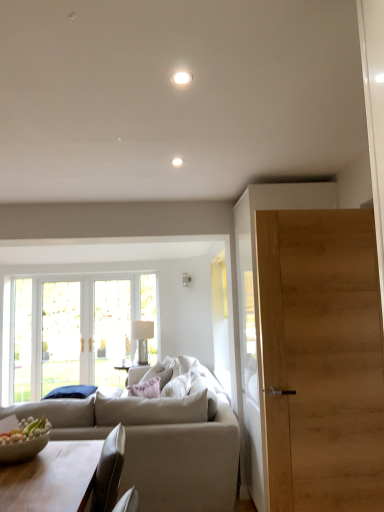
Question: Is white fabric pillow at center far from beige fabric couch at center?

Choices:
 (A) no
 (B) yes

Answer: (A)

Question: Is white fabric pillow at center oriented towards beige fabric couch at center?

Choices:
 (A) yes
 (B) no

Answer: (A)

Question: Is white fabric pillow at center smaller than beige fabric couch at center?

Choices:
 (A) no
 (B) yes

Answer: (B)

Question: Is white fabric pillow at center at the right side of beige fabric couch at center?

Choices:
 (A) yes
 (B) no

Answer: (A)

Question: Is white fabric pillow at center shorter than beige fabric couch at center?

Choices:
 (A) yes
 (B) no

Answer: (A)

Question: From the image's perspective, relative to white fabric pillow at center, is silver metallic lamp at center above or below?

Choices:
 (A) below
 (B) above

Answer: (B)

Question: Is silver metallic lamp at center inside the boundaries of white fabric pillow at center, or outside?

Choices:
 (A) outside
 (B) inside

Answer: (A)

Question: From a real-world perspective, relative to white fabric pillow at center, is silver metallic lamp at center vertically above or below?

Choices:
 (A) above
 (B) below

Answer: (A)

Question: Based on their positions, is silver metallic lamp at center located to the left or right of white fabric pillow at center?

Choices:
 (A) right
 (B) left

Answer: (B)

Question: Is point (87, 467) closer or farther from the camera than point (147, 322)?

Choices:
 (A) farther
 (B) closer

Answer: (B)

Question: In terms of size, does light brown wooden coffee table at lower left appear bigger or smaller than silver metallic lamp at center?

Choices:
 (A) big
 (B) small

Answer: (A)

Question: In the image, is light brown wooden coffee table at lower left positioned in front of or behind silver metallic lamp at center?

Choices:
 (A) behind
 (B) front

Answer: (B)

Question: From a real-world perspective, is light brown wooden coffee table at lower left positioned above or below silver metallic lamp at center?

Choices:
 (A) above
 (B) below

Answer: (B)

Question: Is white fabric pillow at center taller or shorter than silver metallic lamp at center?

Choices:
 (A) short
 (B) tall

Answer: (A)

Question: Based on their sizes in the image, would you say white fabric pillow at center is bigger or smaller than silver metallic lamp at center?

Choices:
 (A) small
 (B) big

Answer: (B)